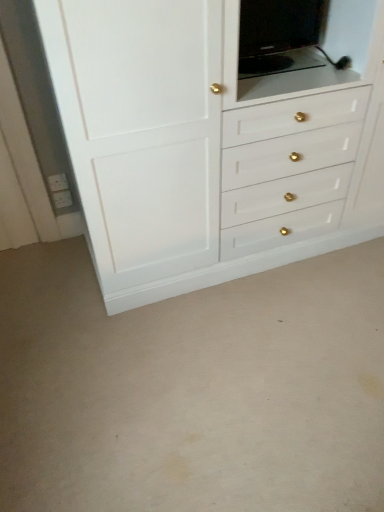
Question: Which is correct: black glossy tv at upper center is inside white glossy cabinet at upper center, or outside of it?

Choices:
 (A) inside
 (B) outside

Answer: (A)

Question: From a real-world perspective, is black glossy tv at upper center above or below white glossy cabinet at upper center?

Choices:
 (A) above
 (B) below

Answer: (A)

Question: From the image's perspective, is black glossy tv at upper center above or below white glossy cabinet at upper center?

Choices:
 (A) below
 (B) above

Answer: (B)

Question: Is white glossy cabinet at upper center in front of or behind black glossy tv at upper center in the image?

Choices:
 (A) front
 (B) behind

Answer: (A)

Question: Is white glossy cabinet at upper center bigger or smaller than black glossy tv at upper center?

Choices:
 (A) big
 (B) small

Answer: (A)

Question: Do you think white glossy cabinet at upper center is within black glossy tv at upper center, or outside of it?

Choices:
 (A) outside
 (B) inside

Answer: (A)

Question: From a real-world perspective, relative to black glossy tv at upper center, is white glossy cabinet at upper center vertically above or below?

Choices:
 (A) below
 (B) above

Answer: (A)